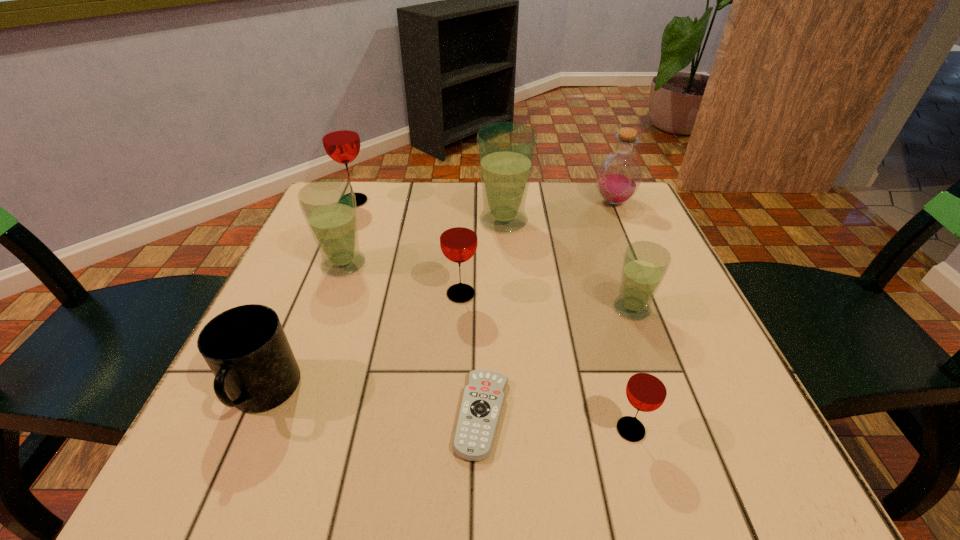
You are a GUI agent. You are given a task and a screenshot of the screen. Output one action in this format:
    pyautogui.click(x=<x>, y=<y>)
    Task: Click on the free space between the second blue glass from left to right and the smallest blue glass
    This screenshot has height=540, width=960.
    Given the screenshot: What is the action you would take?
    pyautogui.click(x=567, y=265)

You are a GUI agent. You are given a task and a screenshot of the screen. Output one action in this format:
    pyautogui.click(x=<x>, y=<y>)
    Task: Click on the free space that is in between the biggest blue glass and the purple bottle
    
    Given the screenshot: What is the action you would take?
    pyautogui.click(x=559, y=212)

This screenshot has width=960, height=540. I want to click on vacant area between the biggest blue glass and the fourth nearest glass, so click(x=423, y=242).

The image size is (960, 540). Identify the location of vacant area that lies between the biggest blue glass and the mug. (383, 308).

The height and width of the screenshot is (540, 960). I want to click on free area in between the mug and the second nearest blue glass, so click(303, 329).

The height and width of the screenshot is (540, 960). I want to click on free space between the remote control and the bottle, so click(x=547, y=308).

Find the location of `unoccupied area between the mug and the leftmost red glass`. unoccupied area between the mug and the leftmost red glass is located at coordinates (308, 298).

Locate an element on the screen. Image resolution: width=960 pixels, height=540 pixels. vacant space that's between the black mug and the rightmost glass is located at coordinates (447, 352).

You are a GUI agent. You are given a task and a screenshot of the screen. Output one action in this format:
    pyautogui.click(x=<x>, y=<y>)
    Task: Click on the sixth closest object to the fourth nearest glass
    Image resolution: width=960 pixels, height=540 pixels.
    Given the screenshot: What is the action you would take?
    pyautogui.click(x=645, y=264)

Identify which object is the fourth nearest to the farthest blue glass. Please provide its 2D coordinates. Your answer should be formatted as a tuple, i.e. [(x, y)], where the tuple contains the x and y coordinates of a point satisfying the conditions above.

[(329, 205)]